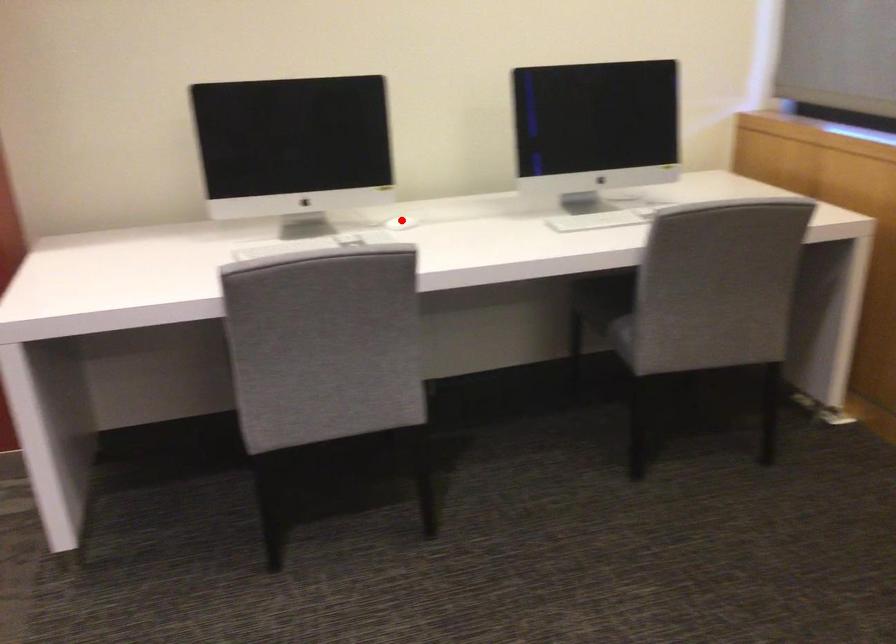
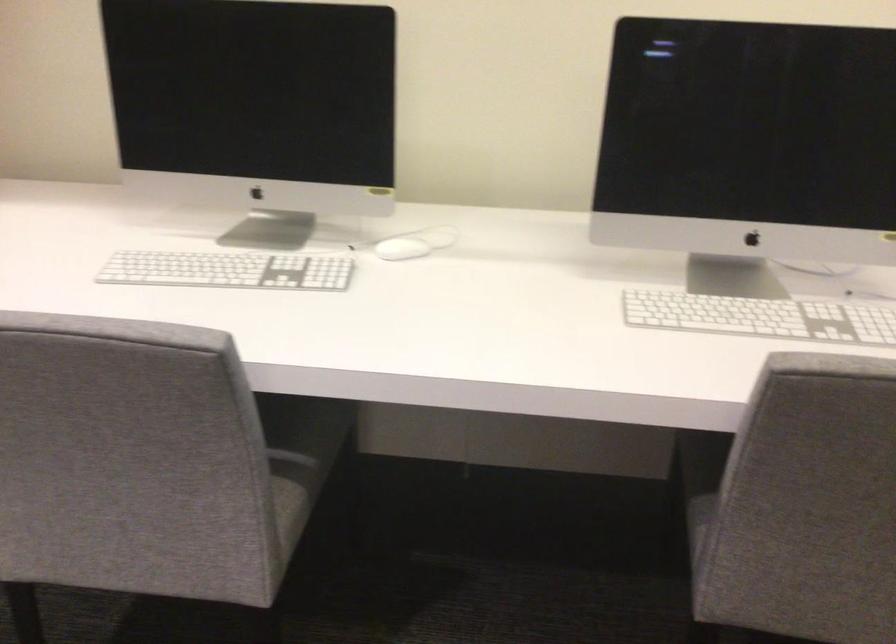
Where in the second image is the point corresponding to the highlighted location from the first image?

(401, 249)